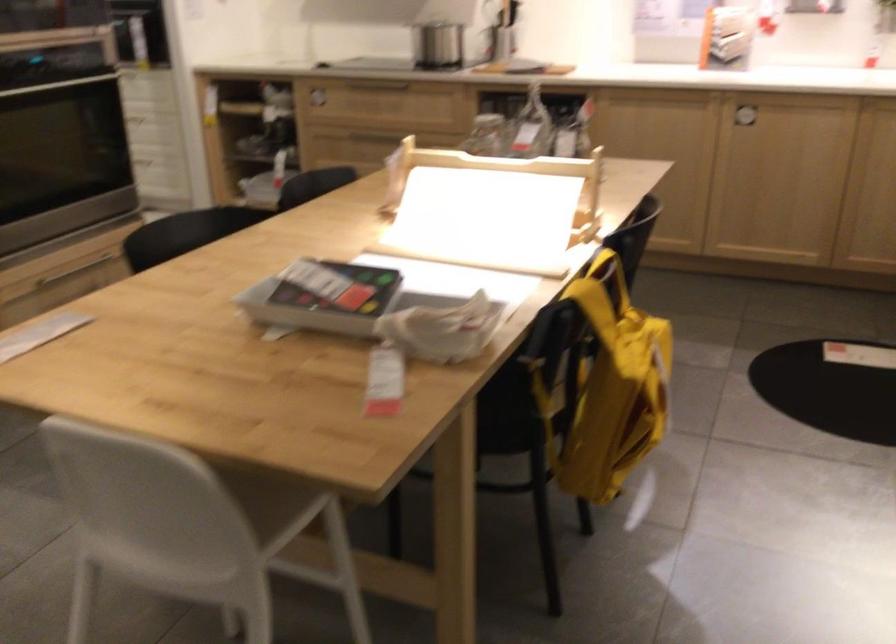
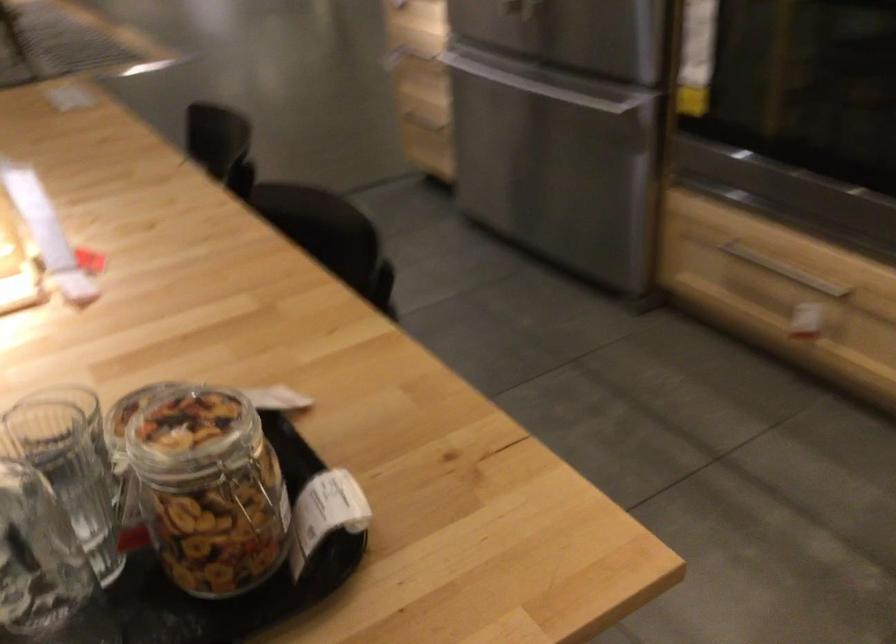
Where in the second image is the point corresponding to (92,267) from the first image?

(784, 270)